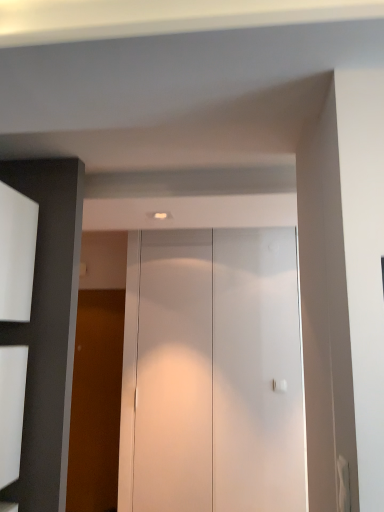
What do you see at coordinates (174, 373) in the screenshot?
I see `transparent glass door at center` at bounding box center [174, 373].

Measure the distance between point (165, 262) and camera.

The distance of point (165, 262) from camera is 3.62 meters.

Find the location of a particular element. transparent glass door at center is located at coordinates (174, 373).

Find the location of a particular element. The image size is (384, 512). transparent glass door at center is located at coordinates (174, 373).